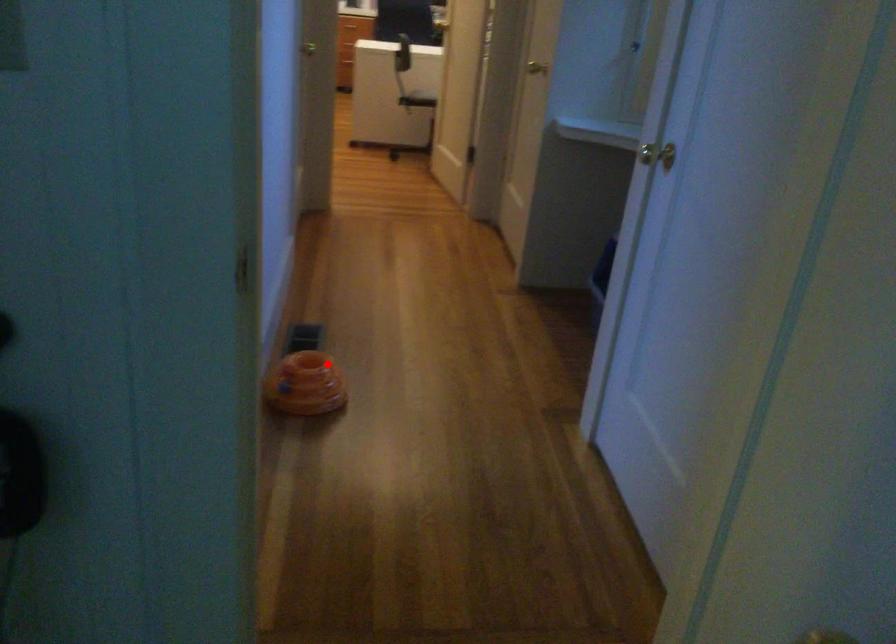
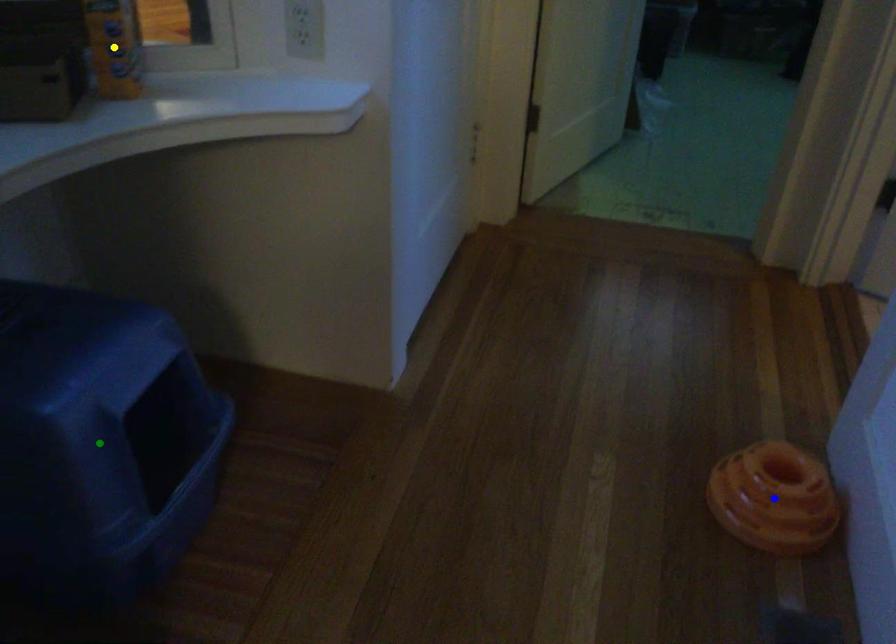
Question: I am providing you with two images of the same scene from different viewpoints. A red point is marked on the first image. You are given multiple points on the second image. Can you choose the point in image 2 that corresponds to the point in image 1?

Choices:
 (A) blue point
 (B) yellow point
 (C) green point

Answer: (A)